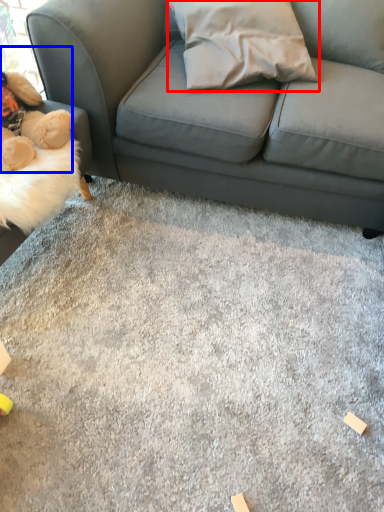
Question: Which point is further to the camera, throw pillow (highlighted by a red box) or toy (highlighted by a blue box)?

Choices:
 (A) throw pillow
 (B) toy

Answer: (A)